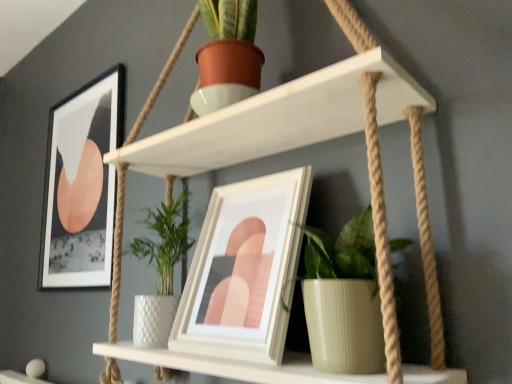
This screenshot has height=384, width=512. What do you see at coordinates (245, 270) in the screenshot?
I see `white glossy picture frame at center, which appears as the 2th picture frame when viewed from the left` at bounding box center [245, 270].

Measure the distance between matte black picture frame at upper left, which appears as the 1th picture frame when viewed from the back, and camera.

They are 4.08 feet apart.

Describe the element at coordinates (280, 119) in the screenshot. The height and width of the screenshot is (384, 512). I see `white matte shelf at upper center` at that location.

What are the coordinates of `white glossy picture frame at center, which appears as the 2th picture frame when viewed from the left` in the screenshot? It's located at (245, 270).

Identify the location of picture frame that is the 1st one when counting downward from the white matte shelf at upper center (from the image's perspective). (81, 185).

From the image's perspective, is matte black picture frame at upper left, which ranks as the 1th picture frame in left-to-right order, under white matte shelf at upper center?

Yes.

Is matte black picture frame at upper left, which is the 2th picture frame from front to back, smaller than white matte shelf at upper center?

Yes, matte black picture frame at upper left, which is the 2th picture frame from front to back, is smaller than white matte shelf at upper center.

Looking at this image, does matte black picture frame at upper left, marked as the 2th picture frame in a right-to-left arrangement, have a greater height compared to white matte shelf at upper center?

Incorrect, the height of matte black picture frame at upper left, marked as the 2th picture frame in a right-to-left arrangement, is not larger of that of white matte shelf at upper center.

Considering the sizes of matte black picture frame at upper left, marked as the 2th picture frame in a right-to-left arrangement, and green ribbed pot at center in the image, is matte black picture frame at upper left, marked as the 2th picture frame in a right-to-left arrangement, wider or thinner than green ribbed pot at center?

In the image, matte black picture frame at upper left, marked as the 2th picture frame in a right-to-left arrangement, appears to be more narrow than green ribbed pot at center.

Measure the distance from matte black picture frame at upper left, marked as the 2th picture frame in a right-to-left arrangement, to green ribbed pot at center.

They are 37.64 inches apart.

From the picture: Between matte black picture frame at upper left, which appears as the 1th picture frame when viewed from the back, and green ribbed pot at center, which one has more height?

matte black picture frame at upper left, which appears as the 1th picture frame when viewed from the back, is taller.

Is white matte shelf at upper center taller than matte black picture frame at upper left, which ranks as the 1th picture frame in left-to-right order?

Correct, white matte shelf at upper center is much taller as matte black picture frame at upper left, which ranks as the 1th picture frame in left-to-right order.

Where is `picture frame above the white matte shelf at upper center (from a real-world perspective)`? This screenshot has height=384, width=512. picture frame above the white matte shelf at upper center (from a real-world perspective) is located at coordinates (81, 185).

Is matte black picture frame at upper left, which appears as the 1th picture frame when viewed from the back, far away from white glossy picture frame at center, which ranks as the second picture frame in back-to-front order?

No, matte black picture frame at upper left, which appears as the 1th picture frame when viewed from the back, is not far from white glossy picture frame at center, which ranks as the second picture frame in back-to-front order.

From a real-world perspective, relative to white glossy picture frame at center, marked as the 1th picture frame in a front-to-back arrangement, is matte black picture frame at upper left, which appears as the 1th picture frame when viewed from the back, vertically above or below?

matte black picture frame at upper left, which appears as the 1th picture frame when viewed from the back, is situated higher than white glossy picture frame at center, marked as the 1th picture frame in a front-to-back arrangement, in the real world.

In terms of size, does matte black picture frame at upper left, which is the 2th picture frame from front to back, appear bigger or smaller than white glossy picture frame at center, which is the first picture frame in right-to-left order?

Considering their sizes, matte black picture frame at upper left, which is the 2th picture frame from front to back, takes up less space than white glossy picture frame at center, which is the first picture frame in right-to-left order.

Does matte black picture frame at upper left, which is the 2th picture frame from front to back, have a lesser width compared to white glossy picture frame at center, which ranks as the second picture frame in back-to-front order?

Correct, the width of matte black picture frame at upper left, which is the 2th picture frame from front to back, is less than that of white glossy picture frame at center, which ranks as the second picture frame in back-to-front order.

Where is `shelf above the white glossy picture frame at center, which is the first picture frame in right-to-left order (from the image's perspective)`? This screenshot has width=512, height=384. shelf above the white glossy picture frame at center, which is the first picture frame in right-to-left order (from the image's perspective) is located at coordinates (280, 119).

Between point (192, 141) and point (253, 331), which one is positioned in front?

The point (253, 331) is closer.

Is white matte shelf at upper center turned away from white glossy picture frame at center, which ranks as the second picture frame in back-to-front order?

Yes, white glossy picture frame at center, which ranks as the second picture frame in back-to-front order, is at the back of white matte shelf at upper center.

Would you say white matte shelf at upper center is outside white glossy picture frame at center, marked as the 1th picture frame in a front-to-back arrangement?

Yes, white matte shelf at upper center is outside of white glossy picture frame at center, marked as the 1th picture frame in a front-to-back arrangement.

Which object is further away from the camera taking this photo, green ribbed pot at center or white matte shelf at upper center?

green ribbed pot at center.

Could you tell me if green ribbed pot at center is facing white matte shelf at upper center?

Yes, green ribbed pot at center is facing white matte shelf at upper center.

Considering the points (319, 311) and (324, 377), which point is in front, point (319, 311) or point (324, 377)?

Point (324, 377)

Identify the location of houseplant lying on the right of white matte shelf at upper center. This screenshot has width=512, height=384. pos(340,301).

Where is `shelf that appears above the green ribbed pot at center (from a real-world perspective)`? This screenshot has width=512, height=384. shelf that appears above the green ribbed pot at center (from a real-world perspective) is located at coordinates point(280,119).

From the image's perspective, which is above, white matte shelf at upper center or green ribbed pot at center?

From the image's view, white matte shelf at upper center is above.

Would you say white matte shelf at upper center is a long distance from green ribbed pot at center?

That's not correct — white matte shelf at upper center is a little close to green ribbed pot at center.

Consider the image. Is white matte shelf at upper center wider than green ribbed pot at center?

Yes, white matte shelf at upper center is wider than green ribbed pot at center.

Locate an element on the screen. shelf located on the right of matte black picture frame at upper left, which appears as the 1th picture frame when viewed from the back is located at coordinates (280, 119).

In order to click on the 2nd picture frame above the green ribbed pot at center (from the image's perspective) in this screenshot , I will do `click(81, 185)`.

Which object lies further to the anchor point white matte shelf at upper center, green ribbed pot at center or matte black picture frame at upper left, marked as the 2th picture frame in a right-to-left arrangement?

Based on the image, matte black picture frame at upper left, marked as the 2th picture frame in a right-to-left arrangement, appears to be further to white matte shelf at upper center.

When comparing their distances from white matte shelf at upper center, does green ribbed pot at center or white glossy picture frame at center, which is the first picture frame in right-to-left order, seem further?

Based on the image, green ribbed pot at center appears to be further to white matte shelf at upper center.

Considering their positions, is white matte shelf at upper center positioned closer to white glossy picture frame at center, which is the first picture frame in right-to-left order, than green ribbed pot at center?

green ribbed pot at center is positioned closer to the anchor white glossy picture frame at center, which is the first picture frame in right-to-left order.

Looking at the image, which one is located further to white matte shelf at upper center, white glossy picture frame at center, which appears as the 2th picture frame when viewed from the left, or green ribbed pot at center?

green ribbed pot at center lies further to white matte shelf at upper center than the other object.

Looking at the image, which one is located closer to white matte shelf at upper center, matte black picture frame at upper left, which appears as the 1th picture frame when viewed from the back, or green ribbed pot at center?

green ribbed pot at center.

When comparing their distances from matte black picture frame at upper left, which appears as the 1th picture frame when viewed from the back, does white matte shelf at upper center or white glossy picture frame at center, which is the first picture frame in right-to-left order, seem closer?

Among the two, white matte shelf at upper center is located nearer to matte black picture frame at upper left, which appears as the 1th picture frame when viewed from the back.

Looking at the image, which one is located further to white glossy picture frame at center, which appears as the 2th picture frame when viewed from the left, green ribbed pot at center or white matte shelf at upper center?

white matte shelf at upper center.

Based on their spatial positions, is matte black picture frame at upper left, which ranks as the 1th picture frame in left-to-right order, or white glossy picture frame at center, which is the first picture frame in right-to-left order, further from green ribbed pot at center?

Among the two, matte black picture frame at upper left, which ranks as the 1th picture frame in left-to-right order, is located further to green ribbed pot at center.

I want to click on picture frame between green ribbed pot at center and matte black picture frame at upper left, which ranks as the 1th picture frame in left-to-right order, along the z-axis, so click(245, 270).

Identify the location of picture frame positioned between white matte shelf at upper center and matte black picture frame at upper left, which appears as the 1th picture frame when viewed from the back, from near to far. The height and width of the screenshot is (384, 512). (245, 270).

At what (x,y) coordinates should I click in order to perform the action: click on houseplant between white matte shelf at upper center and matte black picture frame at upper left, which ranks as the 1th picture frame in left-to-right order, in the front-back direction. Please return your answer as a coordinate pair (x, y). The image size is (512, 384). Looking at the image, I should click on (340, 301).